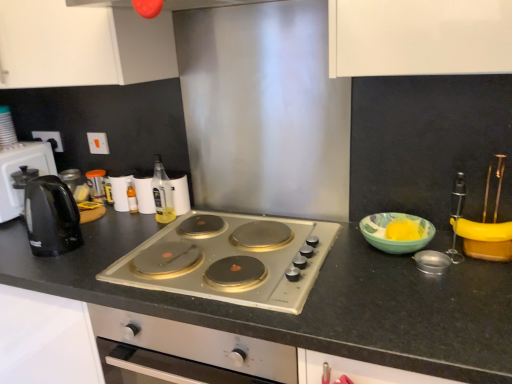
Question: From the image's perspective, does translucent glass bottle at center, which ranks as the 2th bottle in front-to-back order, appear lower than black granite countertop at center?

Choices:
 (A) no
 (B) yes

Answer: (A)

Question: Is black granite countertop at center at the back of translucent glass bottle at center, the 1th bottle positioned from the left?

Choices:
 (A) no
 (B) yes

Answer: (A)

Question: Does translucent glass bottle at center, arranged as the 1th bottle when viewed from the back, have a lesser height compared to black granite countertop at center?

Choices:
 (A) no
 (B) yes

Answer: (B)

Question: Would you say translucent glass bottle at center, the second bottle positioned from the right, contains black granite countertop at center?

Choices:
 (A) no
 (B) yes

Answer: (A)

Question: Can you confirm if translucent glass bottle at center, the second bottle positioned from the right, is smaller than black granite countertop at center?

Choices:
 (A) no
 (B) yes

Answer: (B)

Question: Is black plastic kettle at left bigger or smaller than matte green bowl at right?

Choices:
 (A) small
 (B) big

Answer: (B)

Question: Considering the positions of black plastic kettle at left and matte green bowl at right in the image, is black plastic kettle at left wider or thinner than matte green bowl at right?

Choices:
 (A) wide
 (B) thin

Answer: (A)

Question: From a real-world perspective, is black plastic kettle at left above or below matte green bowl at right?

Choices:
 (A) below
 (B) above

Answer: (B)

Question: From the image's perspective, is black plastic kettle at left above or below matte green bowl at right?

Choices:
 (A) above
 (B) below

Answer: (A)

Question: Looking at their shapes, would you say white matte cabinet at upper left is wider or thinner than matte green bowl at right?

Choices:
 (A) thin
 (B) wide

Answer: (B)

Question: Is point coord(79,66) closer or farther from the camera than point coord(424,221)?

Choices:
 (A) closer
 (B) farther

Answer: (B)

Question: Relative to matte green bowl at right, is white matte cabinet at upper left in front or behind?

Choices:
 (A) behind
 (B) front

Answer: (A)

Question: Considering the positions of white matte cabinet at upper left and matte green bowl at right in the image, is white matte cabinet at upper left taller or shorter than matte green bowl at right?

Choices:
 (A) short
 (B) tall

Answer: (B)

Question: From their relative heights in the image, would you say translucent glass bottle at center, which ranks as the 2th bottle in front-to-back order, is taller or shorter than white matte cabinet at upper left?

Choices:
 (A) short
 (B) tall

Answer: (A)

Question: From the image's perspective, is translucent glass bottle at center, which ranks as the 2th bottle in front-to-back order, positioned above or below white matte cabinet at upper left?

Choices:
 (A) above
 (B) below

Answer: (B)